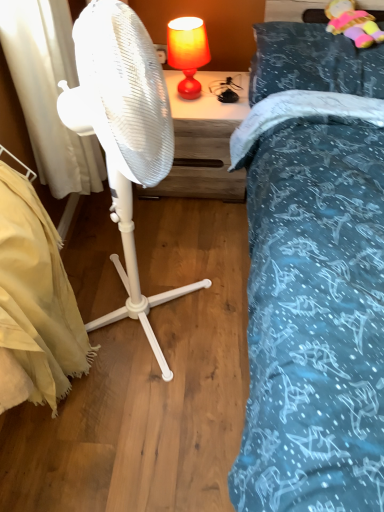
The image size is (384, 512). What are the coordinates of `free space on the front side of wooden nightstand at center` in the screenshot? It's located at (184, 227).